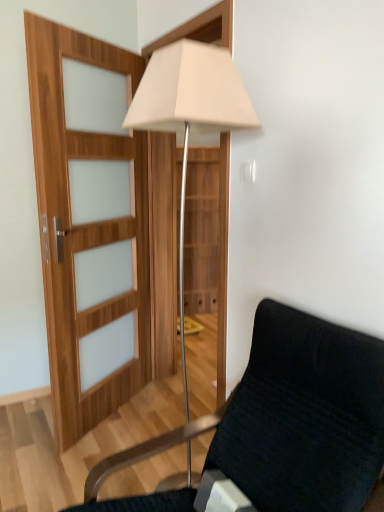
Question: Does point (173, 503) appear closer or farther from the camera than point (145, 87)?

Choices:
 (A) closer
 (B) farther

Answer: (B)

Question: Relative to white fabric lamp at center, is velvet black chair at lower right in front or behind?

Choices:
 (A) front
 (B) behind

Answer: (A)

Question: From the image's perspective, is velvet black chair at lower right positioned above or below white fabric lamp at center?

Choices:
 (A) above
 (B) below

Answer: (B)

Question: From the image's perspective, is white fabric lamp at center positioned above or below velvet black chair at lower right?

Choices:
 (A) below
 (B) above

Answer: (B)

Question: Considering the positions of white fabric lamp at center and velvet black chair at lower right in the image, is white fabric lamp at center bigger or smaller than velvet black chair at lower right?

Choices:
 (A) small
 (B) big

Answer: (A)

Question: Relative to velvet black chair at lower right, is white fabric lamp at center in front or behind?

Choices:
 (A) front
 (B) behind

Answer: (B)

Question: Would you say white fabric lamp at center is to the left or to the right of velvet black chair at lower right in the picture?

Choices:
 (A) right
 (B) left

Answer: (B)